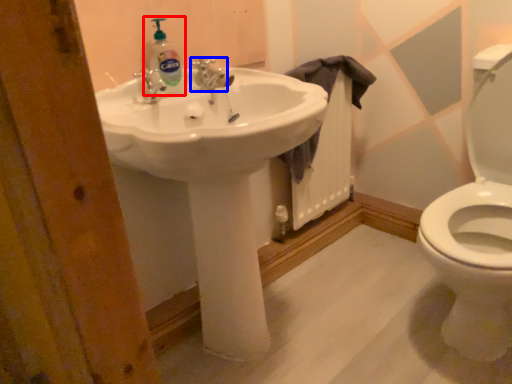
Question: Which object is further to the camera taking this photo, cleaning product (highlighted by a red box) or tap (highlighted by a blue box)?

Choices:
 (A) cleaning product
 (B) tap

Answer: (B)